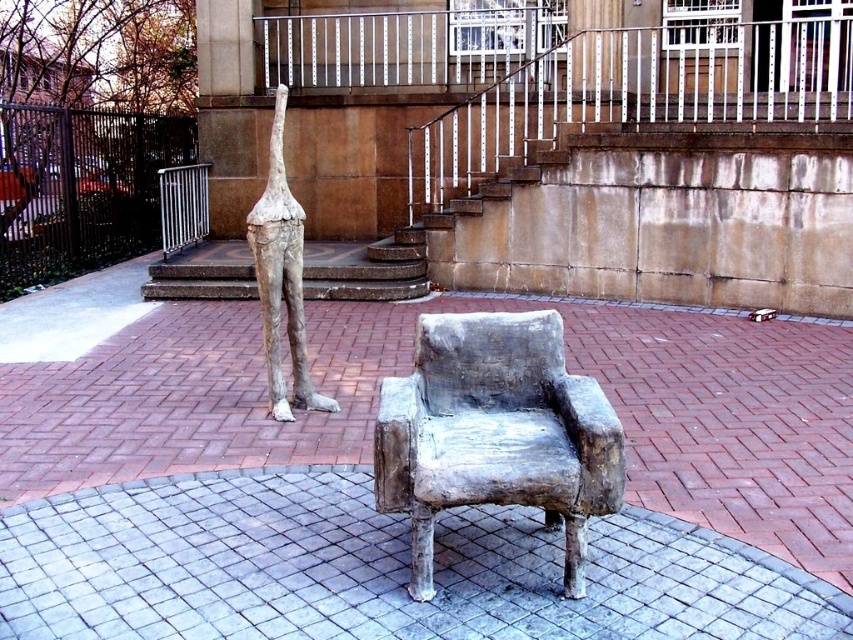
Who is positioned more to the right, matte concrete armchair at center or matte gray sculpture at center?

matte concrete armchair at center is more to the right.

Find the location of a particular element. matte concrete armchair at center is located at coordinates (495, 433).

Identify the location of matte concrete armchair at center. The width and height of the screenshot is (853, 640). [495, 433].